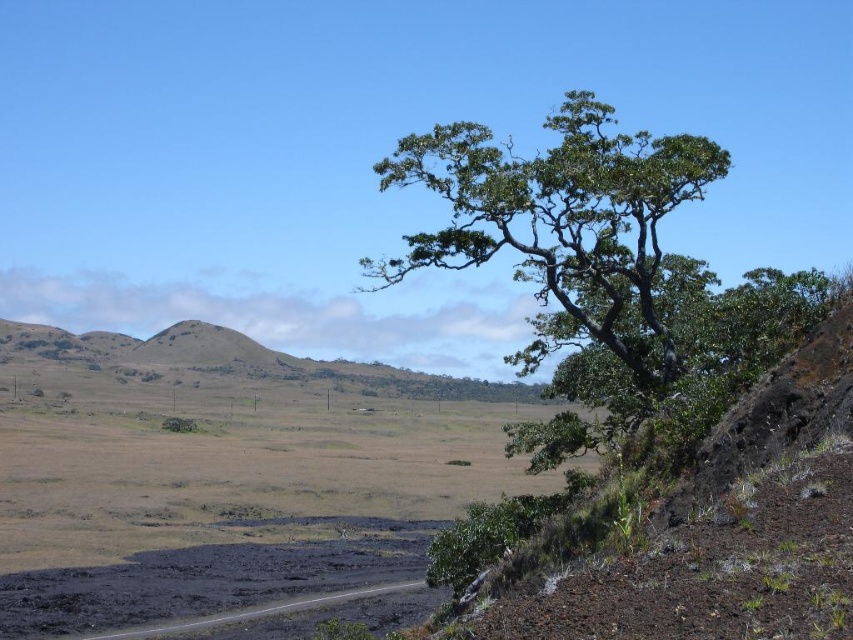
You are a hiker who wants to take a photo of the green leafy tree at upper right while standing on the black asphalt road at lower left. Can you see the entire tree without any obstruction?

The green leafy tree at upper right is above the black asphalt road at lower left, so yes, you can see the entire tree without any obstruction while standing on the road.

You are a hiker trying to navigate from the black asphalt road at lower left to the green leafy tree at upper right. Based on the scene description, which direction should you head to reach the tree?

The green leafy tree at upper right is to the right of the black asphalt road at lower left, so you should head towards the right direction to reach the tree.